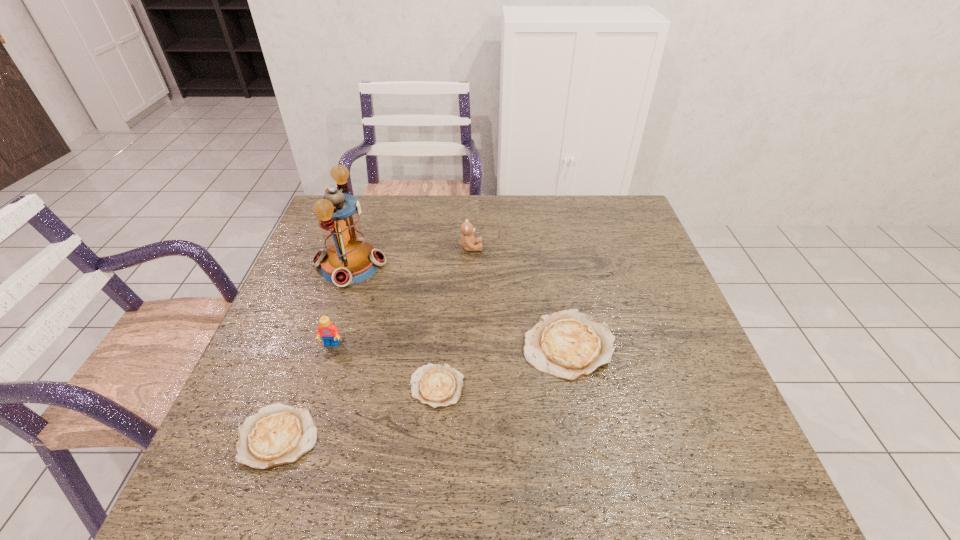
Find the location of a particular element. vacant point that satisfies the following two spatial constraints: 1. on the front-facing side of the teddy bear; 2. on the front side of the leftmost quiche is located at coordinates (467, 437).

This screenshot has width=960, height=540. Find the location of `vacant area that satisfies the following two spatial constraints: 1. on the front-facing side of the teddy bear; 2. on the left side of the rightmost object`. vacant area that satisfies the following two spatial constraints: 1. on the front-facing side of the teddy bear; 2. on the left side of the rightmost object is located at coordinates (468, 345).

The width and height of the screenshot is (960, 540). In order to click on vacant area that satisfies the following two spatial constraints: 1. on the back side of the shortest object; 2. on the left side of the fifth tallest object in this screenshot , I will do `click(297, 387)`.

Locate an element on the screen. The width and height of the screenshot is (960, 540). vacant space that satisfies the following two spatial constraints: 1. on the front-facing side of the rightmost object; 2. on the right side of the teddy bear is located at coordinates (468, 345).

You are a GUI agent. You are given a task and a screenshot of the screen. Output one action in this format:
    pyautogui.click(x=<x>, y=<y>)
    Task: Click on the blank area in the image that satisfies the following two spatial constraints: 1. on the front-facing side of the teddy bear; 2. on the face of the Lego
    
    Given the screenshot: What is the action you would take?
    pyautogui.click(x=468, y=345)

What are the coordinates of `vacant region that satisfies the following two spatial constraints: 1. on the face of the Lego; 2. on the right side of the shortest quiche` in the screenshot? It's located at (318, 387).

Find the location of a particular element. This screenshot has height=540, width=960. free region that satisfies the following two spatial constraints: 1. on the front-facing side of the shortest quiche; 2. on the right side of the tallest object is located at coordinates (310, 387).

The image size is (960, 540). I want to click on vacant space that satisfies the following two spatial constraints: 1. on the front-facing side of the lantern; 2. on the right side of the second quiche from left to right, so click(310, 387).